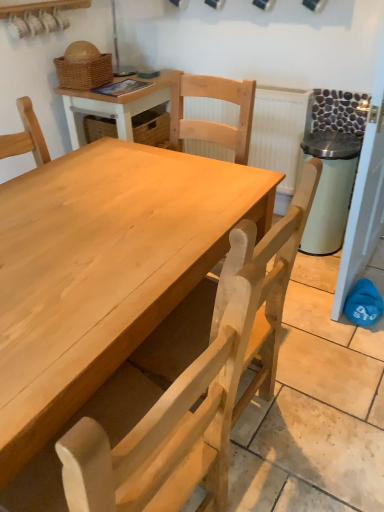
The width and height of the screenshot is (384, 512). In order to click on woven brown basket at upper left in this screenshot , I will do `click(84, 73)`.

You are a GUI agent. You are given a task and a screenshot of the screen. Output one action in this format:
    pyautogui.click(x=<x>, y=<y>)
    Task: Click on the woven brown basket at upper left
    This screenshot has height=512, width=384.
    Given the screenshot: What is the action you would take?
    pyautogui.click(x=84, y=73)

In order to click on radiator that is above the natural wood chair at center (from a real-world perspective) in this screenshot , I will do (x=279, y=132).

Is natural wood chair at center wider or thinner than white textured radiator at upper center?

Clearly, natural wood chair at center has more width compared to white textured radiator at upper center.

Between natural wood chair at center and white textured radiator at upper center, which one is positioned behind?

white textured radiator at upper center is further away from the camera.

Is woven brown basket at upper left oriented towards white textured radiator at upper center?

No.

Locate an element on the screen. basket above the white textured radiator at upper center (from a real-world perspective) is located at coordinates (84, 73).

Is woven brown basket at upper left directly adjacent to white textured radiator at upper center?

No, woven brown basket at upper left is not in contact with white textured radiator at upper center.

Which is behind, white textured radiator at upper center or natural wood chair at center?

white textured radiator at upper center is behind.

Measure the distance between white textured radiator at upper center and natural wood chair at center.

A distance of 1.44 meters exists between white textured radiator at upper center and natural wood chair at center.

Based on the photo, is white textured radiator at upper center with natural wood chair at center?

There is a gap between white textured radiator at upper center and natural wood chair at center.

From a real-world perspective, is white textured radiator at upper center located higher than natural wood chair at center?

Yes.

From the picture: Is woven brown basket at upper left inside the boundaries of wooden table at center, or outside?

woven brown basket at upper left lies outside wooden table at center.

Is woven brown basket at upper left positioned with its back to wooden table at center?

woven brown basket at upper left does not have its back to wooden table at center.

Find the location of a particular element. The height and width of the screenshot is (512, 384). table below the woven brown basket at upper left (from the image's perspective) is located at coordinates (114, 106).

From the image's perspective, is woven brown basket at upper left beneath wooden table at center?

Incorrect, from the image's perspective, woven brown basket at upper left is higher than wooden table at center.

Who is smaller, natural wood chair at center or woven brown basket at upper left?

With smaller size is woven brown basket at upper left.

Is natural wood chair at center facing towards woven brown basket at upper left?

No.

Relative to woven brown basket at upper left, is natural wood chair at center in front or behind?

natural wood chair at center is positioned closer to the viewer than woven brown basket at upper left.

Who is bigger, wooden table at center or white textured radiator at upper center?

Bigger between the two is wooden table at center.

Which is in front, point (172, 82) or point (227, 157)?

The point (172, 82) is more forward.

What are the coordinates of `table to the left of white textured radiator at upper center` in the screenshot? It's located at (114, 106).

From the image's perspective, is wooden table at center below white textured radiator at upper center?

A: No, from the image's perspective, wooden table at center is not below white textured radiator at upper center.

What's the angular difference between white textured radiator at upper center and woven brown basket at upper left's facing directions?

The angle between the facing direction of white textured radiator at upper center and the facing direction of woven brown basket at upper left is 92 degrees.

Is white textured radiator at upper center looking in the opposite direction of woven brown basket at upper left?

No.

From a real-world perspective, who is located lower, white textured radiator at upper center or woven brown basket at upper left?

From a 3D spatial view, white textured radiator at upper center is below.

Can you confirm if white textured radiator at upper center is thinner than woven brown basket at upper left?

Indeed, white textured radiator at upper center has a lesser width compared to woven brown basket at upper left.

Locate an element on the screen. The image size is (384, 512). radiator lying on the right of natural wood chair at center is located at coordinates (279, 132).

At what (x,y) coordinates should I click in order to perform the action: click on basket that appears in front of the white textured radiator at upper center. Please return your answer as a coordinate pair (x, y). The height and width of the screenshot is (512, 384). Looking at the image, I should click on (84, 73).

Estimate the real-world distances between objects in this image. Which object is further from woven brown basket at upper left, white textured radiator at upper center or natural wood chair at center?

natural wood chair at center.

Which object lies further to the anchor point wooden table at center, woven brown basket at upper left or natural wood chair at center?

natural wood chair at center is further to wooden table at center.

Estimate the real-world distances between objects in this image. Which object is further from natural wood chair at center, wooden table at center or woven brown basket at upper left?

woven brown basket at upper left.

Estimate the real-world distances between objects in this image. Which object is closer to natural wood chair at center, woven brown basket at upper left or white textured radiator at upper center?

Among the two, white textured radiator at upper center is located nearer to natural wood chair at center.

Considering their positions, is wooden table at center positioned further to woven brown basket at upper left than white textured radiator at upper center?

white textured radiator at upper center is further to woven brown basket at upper left.

Estimate the real-world distances between objects in this image. Which object is closer to wooden table at center, woven brown basket at upper left or white textured radiator at upper center?

woven brown basket at upper left.

Estimate the real-world distances between objects in this image. Which object is further from white textured radiator at upper center, woven brown basket at upper left or natural wood chair at center?

natural wood chair at center is positioned further to the anchor white textured radiator at upper center.

Estimate the real-world distances between objects in this image. Which object is closer to natural wood chair at center, white textured radiator at upper center or woven brown basket at upper left?

Among the two, white textured radiator at upper center is located nearer to natural wood chair at center.

Find the location of a particular element. Image resolution: width=384 pixels, height=512 pixels. table positioned between natural wood chair at center and woven brown basket at upper left from near to far is located at coordinates (114, 106).

Where is `table between natural wood chair at center and white textured radiator at upper center in the front-back direction`? table between natural wood chair at center and white textured radiator at upper center in the front-back direction is located at coordinates (114, 106).

Identify the location of table situated between woven brown basket at upper left and white textured radiator at upper center from left to right. (114, 106).

Identify the location of basket between natural wood chair at center and white textured radiator at upper center along the z-axis. (84, 73).